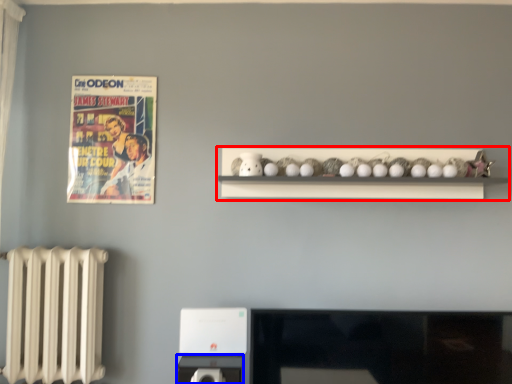
Question: Among these objects, which one is farthest to the camera, shelf (highlighted by a red box) or appliance (highlighted by a blue box)?

Choices:
 (A) shelf
 (B) appliance

Answer: (A)